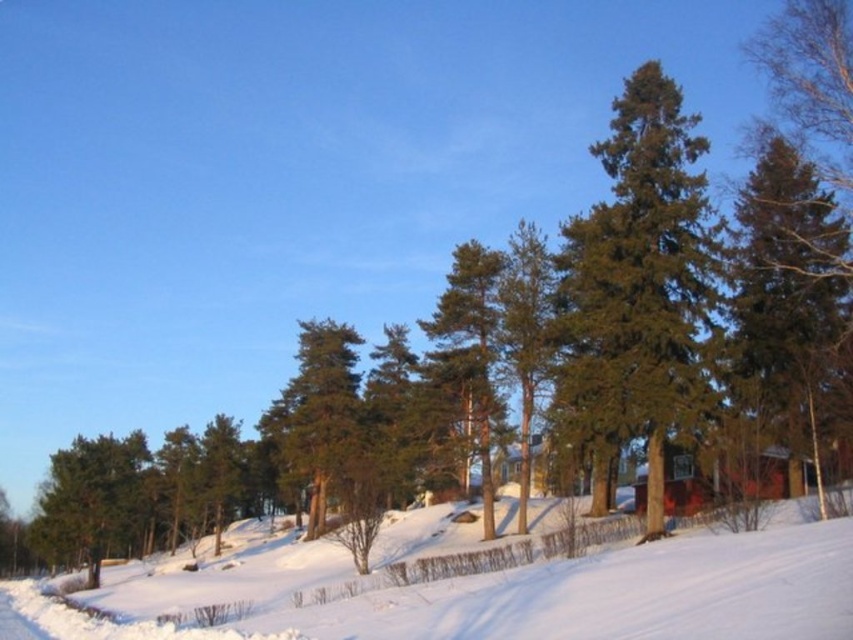
Between green needle-like at center and green textured pine tree at center, which one has less height?

Standing shorter between the two is green textured pine tree at center.

You are a GUI agent. You are given a task and a screenshot of the screen. Output one action in this format:
    pyautogui.click(x=<x>, y=<y>)
    Task: Click on the green needle-like at center
    Image resolution: width=853 pixels, height=640 pixels.
    Given the screenshot: What is the action you would take?
    pyautogui.click(x=636, y=284)

Does point (701, 136) come behind point (535, 344)?

No, (701, 136) is in front of (535, 344).

Identify the location of green needle-like at center. The width and height of the screenshot is (853, 640). (636, 284).

Is green needle-like at center behind green matte tree at center?

That is False.

Between green needle-like at center and green matte tree at center, which one has less height?

green needle-like at center is shorter.

Between point (621, 314) and point (322, 472), which one is positioned behind?

Positioned behind is point (322, 472).

The width and height of the screenshot is (853, 640). I want to click on green needle-like at center, so click(636, 284).

Which is more to the left, white snow ski slope at lower left or green matte tree at lower left?

From the viewer's perspective, green matte tree at lower left appears more on the left side.

Between white snow ski slope at lower left and green matte tree at lower left, which one is positioned lower?

Positioned lower is green matte tree at lower left.

Find the location of `white snow ski slope at lower left`. white snow ski slope at lower left is located at coordinates (550, 593).